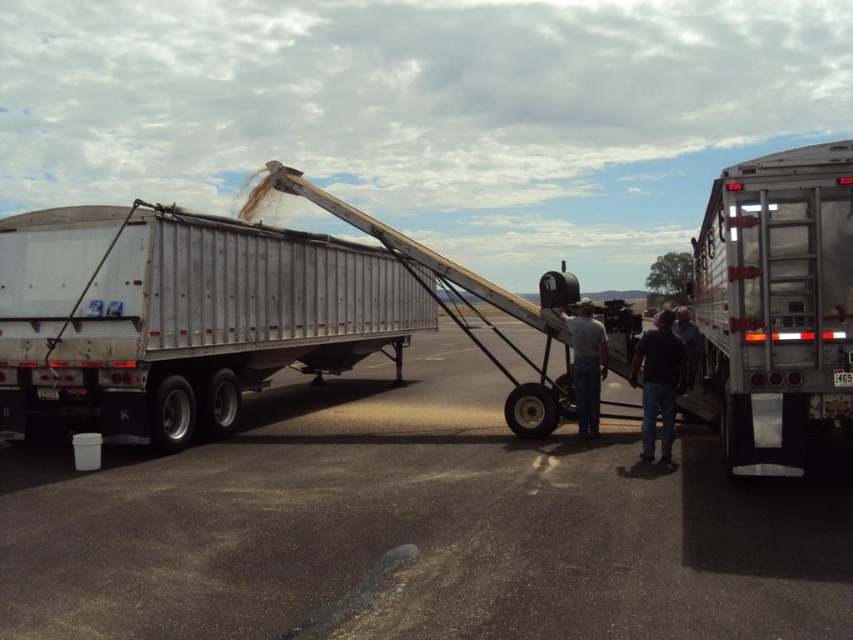
Question: Which object is the farthest from the dark blue jeans at lower right?

Choices:
 (A) denim jeans at center
 (B) silver metallic trailer at left

Answer: (B)

Question: Does denim jeans at center appear on the left side of dark blue jeans at lower right?

Choices:
 (A) yes
 (B) no

Answer: (A)

Question: From the image, what is the correct spatial relationship of silver metallic trailer at right in relation to denim jeans at center?

Choices:
 (A) left
 (B) right

Answer: (B)

Question: Which point is farther to the camera?

Choices:
 (A) (653, 380)
 (B) (804, 208)

Answer: (A)

Question: Among these objects, which one is nearest to the camera?

Choices:
 (A) denim jeans at center
 (B) dark blue jeans at lower right

Answer: (B)

Question: Is silver metallic trailer at right below dark blue jeans at center?

Choices:
 (A) no
 (B) yes

Answer: (A)